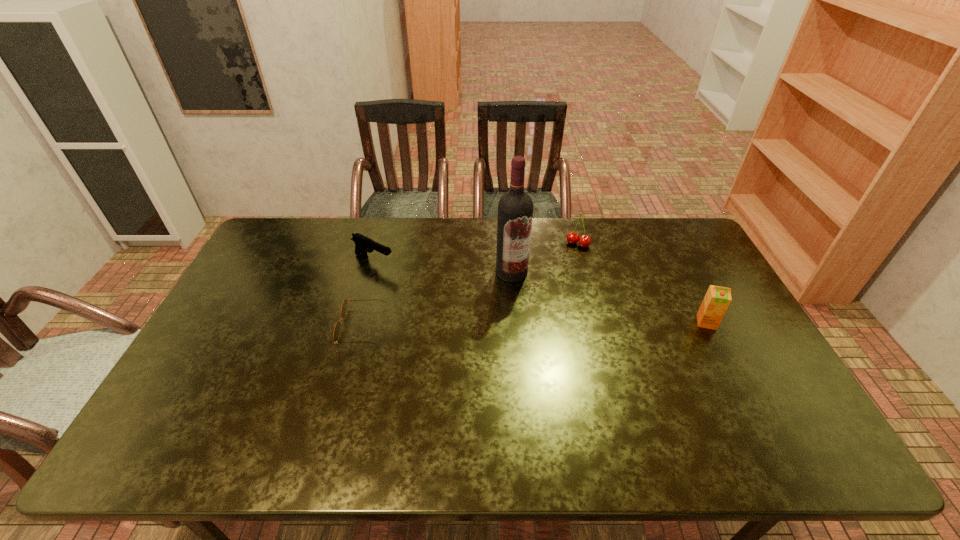
Find the location of a particular element. The height and width of the screenshot is (540, 960). free point between the rightmost object and the pistol is located at coordinates (540, 292).

The height and width of the screenshot is (540, 960). I want to click on free space between the wine bottle and the shortest object, so click(437, 299).

At what (x,y) coordinates should I click in order to perform the action: click on vacant area between the fourth object from left to right and the second tallest object. Please return your answer as a coordinate pair (x, y). Looking at the image, I should click on point(642,283).

This screenshot has width=960, height=540. Find the location of `vacant area between the farthest object and the sunglasses`. vacant area between the farthest object and the sunglasses is located at coordinates (470, 285).

Image resolution: width=960 pixels, height=540 pixels. What are the coordinates of `empty location between the pistol and the orange juice` in the screenshot? It's located at (540, 292).

The image size is (960, 540). Find the location of `unoccupied area between the third object from right to left and the orange juice`. unoccupied area between the third object from right to left and the orange juice is located at coordinates [x=609, y=298].

The height and width of the screenshot is (540, 960). Find the location of `vacant area that lies between the sunglasses and the pistol`. vacant area that lies between the sunglasses and the pistol is located at coordinates (368, 294).

Image resolution: width=960 pixels, height=540 pixels. I want to click on vacant region between the orange juice and the pistol, so click(540, 292).

Find the location of `free area in between the tallest object and the pistol`. free area in between the tallest object and the pistol is located at coordinates (443, 267).

Identify the location of free space between the second object from right to left and the tallest object. (544, 258).